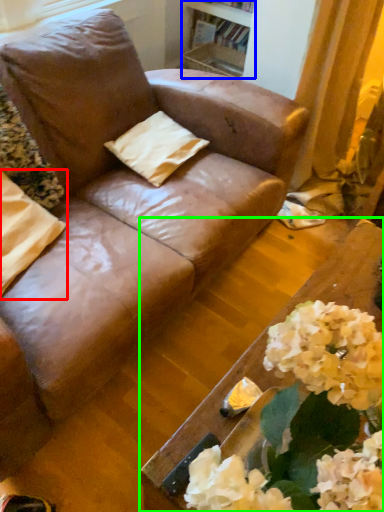
Question: Which is nearer to the pillow (highlighted by a red box)? bookshelf (highlighted by a blue box) or table (highlighted by a green box).

Choices:
 (A) bookshelf
 (B) table

Answer: (B)